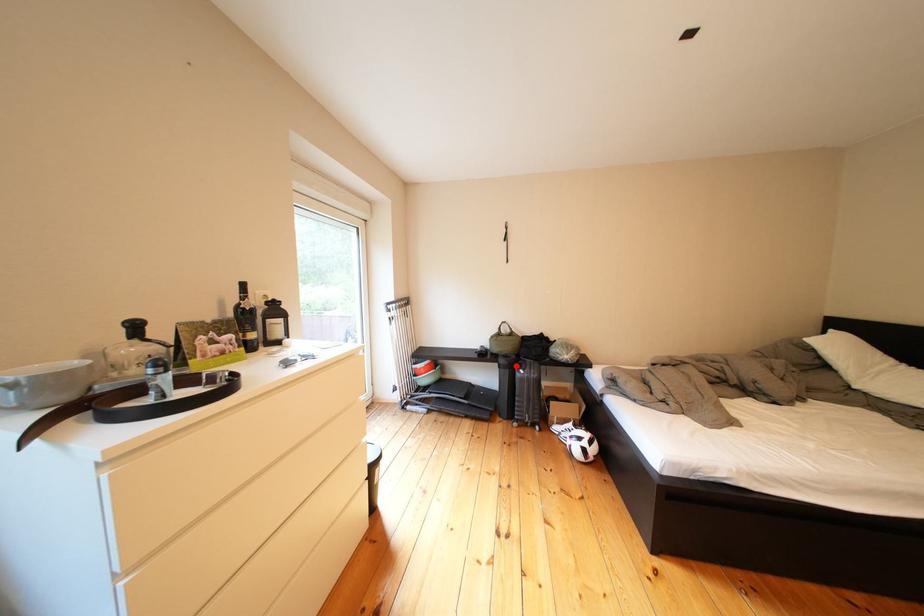
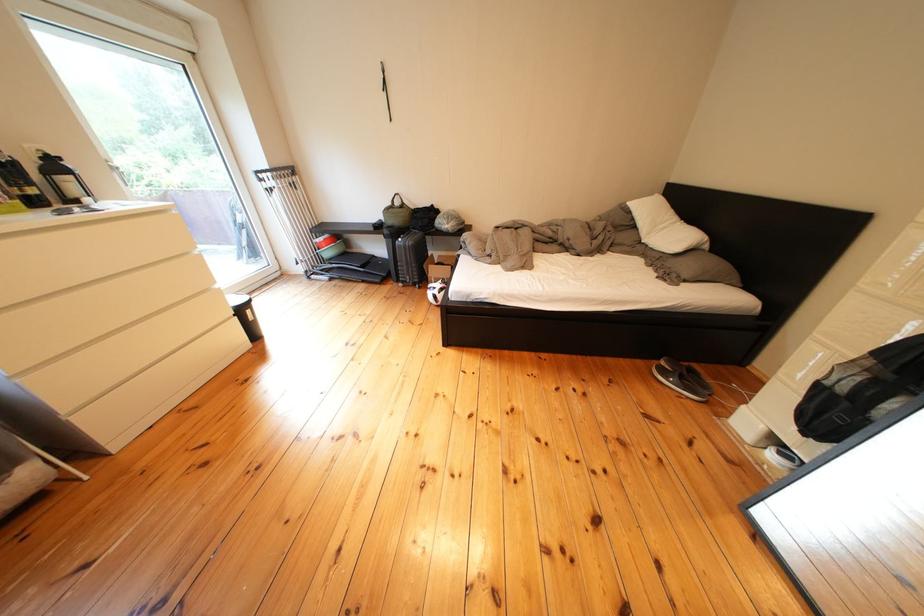
Find the pixel in the second image that matches the highlighted location in the first image.

(399, 236)